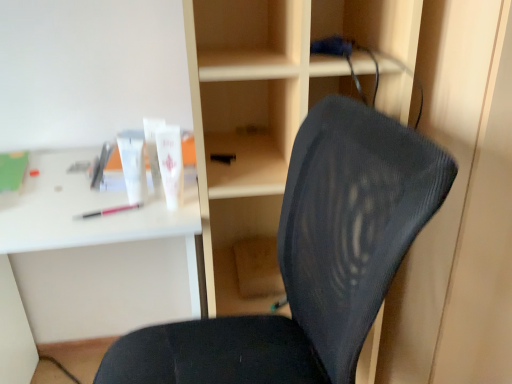
Image resolution: width=512 pixels, height=384 pixels. Describe the element at coordinates (133, 164) in the screenshot. I see `white matte tube at upper left, the 1th toiletry in the left-to-right sequence` at that location.

Measure the distance between point (154, 141) and camera.

Point (154, 141) and camera are 33.03 inches apart from each other.

This screenshot has height=384, width=512. In order to click on white glossy tube at upper center, the 2th toiletry viewed from the right in this screenshot , I will do `click(153, 152)`.

You are a GUI agent. You are given a task and a screenshot of the screen. Output one action in this format:
    pyautogui.click(x=<x>, y=<y>)
    Task: Click on the pink plastic pen at left
    This screenshot has width=512, height=384.
    Given the screenshot: What is the action you would take?
    pyautogui.click(x=108, y=211)

Describe the element at coordinates (108, 211) in the screenshot. I see `pink plastic pen at left` at that location.

Locate an element on the screen. white matte tube at upper left, the 1th toiletry in the left-to-right sequence is located at coordinates (133, 164).

Based on the photo, does white matte tube at upper center, the first toiletry from the right, have a lesser width compared to pink plastic pen at left?

No, white matte tube at upper center, the first toiletry from the right, is not thinner than pink plastic pen at left.

From the image's perspective, is white matte tube at upper center, the 3th toiletry in the left-to-right sequence, located above pink plastic pen at left?

Yes, from the image's perspective, white matte tube at upper center, the 3th toiletry in the left-to-right sequence, is above pink plastic pen at left.

Between white matte tube at upper center, the first toiletry from the right, and pink plastic pen at left, which one appears on the left side from the viewer's perspective?

Answer: pink plastic pen at left.

Are white matte tube at upper center, the 3th toiletry in the left-to-right sequence, and pink plastic pen at left far apart?

white matte tube at upper center, the 3th toiletry in the left-to-right sequence, is actually quite close to pink plastic pen at left.

Can you confirm if white plastic desk at upper left is taller than wooden at center?

No, white plastic desk at upper left is not taller than wooden at center.

Is white plastic desk at upper left outside of wooden at center?

That's correct, white plastic desk at upper left is outside of wooden at center.

In the image, is white plastic desk at upper left on the left side or the right side of wooden at center?

white plastic desk at upper left is positioned on wooden at center's left side.

Does white plastic desk at upper left have a larger size compared to wooden at center?

Correct, white plastic desk at upper left is larger in size than wooden at center.

In order to click on toiletry that is the 3rd object located above the white plastic desk at upper left (from the image's perspective) in this screenshot , I will do `click(153, 152)`.

Is white glossy tube at upper center, positioned as the second toiletry in left-to-right order, far from white plastic desk at upper left?

They are positioned close to each other.

Based on the photo, would you say white glossy tube at upper center, positioned as the second toiletry in left-to-right order, is outside white plastic desk at upper left?

white glossy tube at upper center, positioned as the second toiletry in left-to-right order, is positioned outside white plastic desk at upper left.

Which is in front, white glossy tube at upper center, positioned as the second toiletry in left-to-right order, or white plastic desk at upper left?

white plastic desk at upper left.

From a real-world perspective, between black mesh chair at center and white plastic desk at upper left, who is vertically lower?

white plastic desk at upper left.

Who is bigger, black mesh chair at center or white plastic desk at upper left?

white plastic desk at upper left.

Considering the sizes of objects black mesh chair at center and white plastic desk at upper left in the image provided, who is taller, black mesh chair at center or white plastic desk at upper left?

Standing taller between the two is black mesh chair at center.

Consider the image. Which is farther, (358, 233) or (170, 217)?

The point (170, 217) is farther from the camera.

Does white matte tube at upper left, the 1th toiletry in the left-to-right sequence, lie in front of pink plastic pen at left?

Yes.

Looking at this image, which point is more forward, (117,141) or (104,211)?

The point (104,211) is in front.

In the image, there is a white matte tube at upper left, the 1th toiletry in the left-to-right sequence. Identify the location of stationery below it (from a real-world perspective). (108, 211).

Considering the relative sizes of white matte tube at upper left, the 1th toiletry in the left-to-right sequence, and pink plastic pen at left in the image provided, is white matte tube at upper left, the 1th toiletry in the left-to-right sequence, bigger than pink plastic pen at left?

Indeed, white matte tube at upper left, the 1th toiletry in the left-to-right sequence, has a larger size compared to pink plastic pen at left.

Considering the relative sizes of black mesh chair at center and white matte tube at upper center, the 3th toiletry in the left-to-right sequence, in the image provided, is black mesh chair at center bigger than white matte tube at upper center, the 3th toiletry in the left-to-right sequence,?

Yes.

Is the surface of black mesh chair at center in direct contact with white matte tube at upper center, the 3th toiletry in the left-to-right sequence?

black mesh chair at center and white matte tube at upper center, the 3th toiletry in the left-to-right sequence, are clearly separated.

Which is behind, black mesh chair at center or white matte tube at upper center, the first toiletry from the right?

Positioned behind is white matte tube at upper center, the first toiletry from the right.

Is there a large distance between black mesh chair at center and white matte tube at upper left, the 1th toiletry in the left-to-right sequence?

No, black mesh chair at center is in close proximity to white matte tube at upper left, the 1th toiletry in the left-to-right sequence.

Considering the sizes of objects black mesh chair at center and white matte tube at upper left, arranged as the third toiletry when viewed from the right, in the image provided, who is bigger, black mesh chair at center or white matte tube at upper left, arranged as the third toiletry when viewed from the right,?

With larger size is black mesh chair at center.

Is black mesh chair at center turned away from white matte tube at upper left, arranged as the third toiletry when viewed from the right?

No, black mesh chair at center is not facing away from white matte tube at upper left, arranged as the third toiletry when viewed from the right.

Find the location of `the 1st toiletry above the black mesh chair at center (from the image's perspective)`. the 1st toiletry above the black mesh chair at center (from the image's perspective) is located at coordinates (133, 164).

Starting from the pink plastic pen at left, which toiletry is the 2nd one in front? Please provide its 2D coordinates.

[(170, 164)]

This screenshot has height=384, width=512. What are the coordinates of `computer desk that appears on the left of wooden at center` in the screenshot? It's located at (82, 246).

From the image, which object appears to be farther from pink plastic pen at left, white glossy tube at upper center, the 2th toiletry viewed from the right, or black mesh chair at center?

black mesh chair at center lies further to pink plastic pen at left than the other object.

Estimate the real-world distances between objects in this image. Which object is further from white matte tube at upper center, the first toiletry from the right, wooden at center or pink plastic pen at left?

wooden at center is positioned further to the anchor white matte tube at upper center, the first toiletry from the right.

Based on their spatial positions, is pink plastic pen at left or wooden at center closer to black mesh chair at center?

wooden at center is closer to black mesh chair at center.

Estimate the real-world distances between objects in this image. Which object is further from wooden at center, pink plastic pen at left or white matte tube at upper center, the first toiletry from the right?

The object further to wooden at center is pink plastic pen at left.

Based on their spatial positions, is white plastic desk at upper left or white matte tube at upper center, the first toiletry from the right, closer to white glossy tube at upper center, the 2th toiletry viewed from the right?

white matte tube at upper center, the first toiletry from the right, is positioned closer to the anchor white glossy tube at upper center, the 2th toiletry viewed from the right.

Estimate the real-world distances between objects in this image. Which object is closer to black mesh chair at center, wooden at center or white matte tube at upper left, the 1th toiletry in the left-to-right sequence?

The object closer to black mesh chair at center is wooden at center.

Considering their positions, is white matte tube at upper center, the 3th toiletry in the left-to-right sequence, positioned closer to white matte tube at upper left, arranged as the third toiletry when viewed from the right, than white plastic desk at upper left?

white matte tube at upper center, the 3th toiletry in the left-to-right sequence, is closer to white matte tube at upper left, arranged as the third toiletry when viewed from the right.

Looking at the image, which one is located further to white matte tube at upper left, the 1th toiletry in the left-to-right sequence, black mesh chair at center or white matte tube at upper center, the 3th toiletry in the left-to-right sequence?

black mesh chair at center.

You are a GUI agent. You are given a task and a screenshot of the screen. Output one action in this format:
    pyautogui.click(x=<x>, y=<y>)
    Task: Click on the computer desk positioned between black mesh chair at center and white matte tube at upper center, the first toiletry from the right, from near to far
    This screenshot has height=384, width=512.
    Given the screenshot: What is the action you would take?
    pyautogui.click(x=82, y=246)

Find the location of `bookshelf located between black mesh chair at center and pink plastic pen at left in the depth direction`. bookshelf located between black mesh chair at center and pink plastic pen at left in the depth direction is located at coordinates (275, 111).

Where is `stationery that lies between white glossy tube at upper center, positioned as the second toiletry in left-to-right order, and white plastic desk at upper left from top to bottom`? This screenshot has width=512, height=384. stationery that lies between white glossy tube at upper center, positioned as the second toiletry in left-to-right order, and white plastic desk at upper left from top to bottom is located at coordinates (108, 211).

Identify the location of chair between white plastic desk at upper left and wooden at center in the horizontal direction. (311, 260).